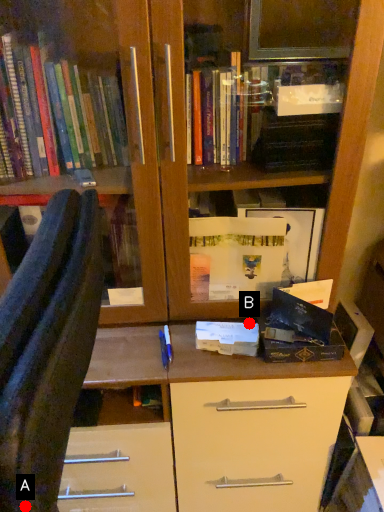
Question: Two points are circled on the image, labeled by A and B beside each circle. Which point is farther to the camera?

Choices:
 (A) A is further
 (B) B is further

Answer: (B)